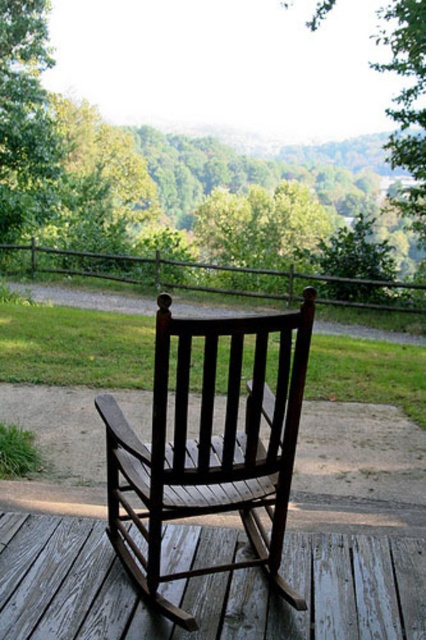
You are standing on the wooden deck and want to place a 1.5 meter long wooden bench between the green leafy tree at upper center and the dark brown wood rocking chair at center. Can the bench fit between them without overlapping either object?

The distance between the green leafy tree at upper center and the dark brown wood rocking chair at center is 14.02 meters. Since the bench is only 1.5 meters long, there is sufficient space to place it between them without overlapping either object.

You are standing on the wooden deck and looking towards the forest. There are two points marked in the image, point 1 at coordinates point (109, 236) and point 2 at coordinates point (5, 545). Which point is closer to you?

Point (5, 545) is closer to you because it is in front of point (109, 236).